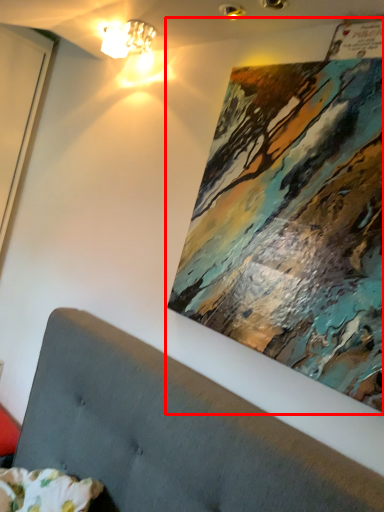
Question: From the image, what is the correct spatial relationship of picture frame (annotated by the red box) in relation to lamp?

Choices:
 (A) right
 (B) left

Answer: (A)